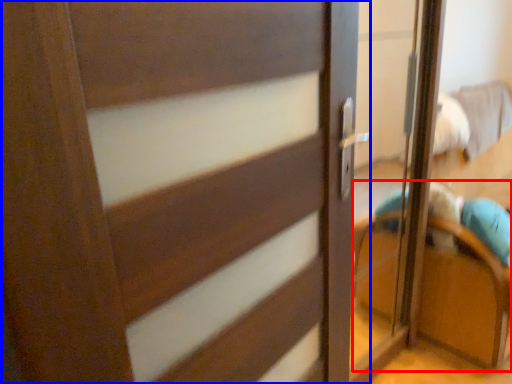
Question: Among these objects, which one is nearest to the camera, armchair (highlighted by a red box) or door (highlighted by a blue box)?

Choices:
 (A) armchair
 (B) door

Answer: (B)